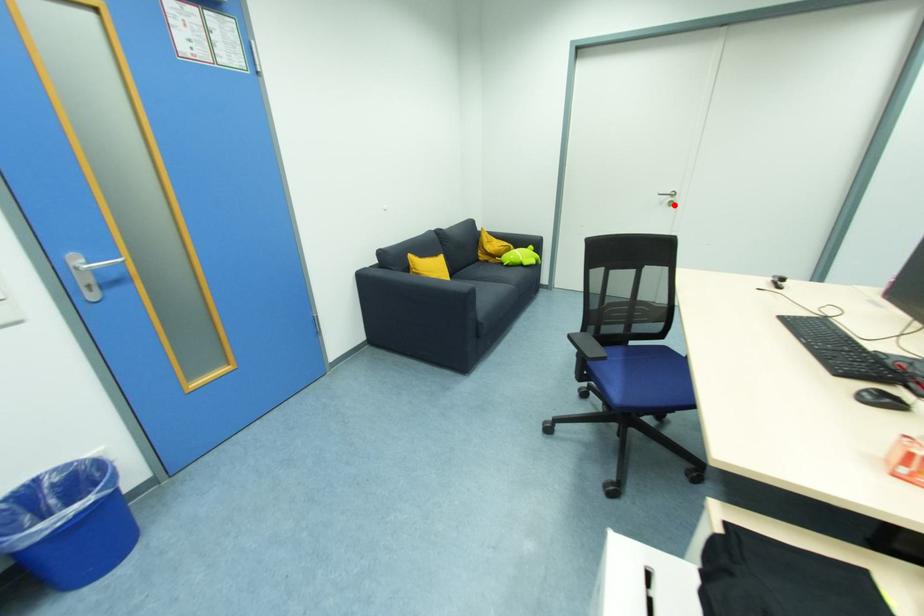
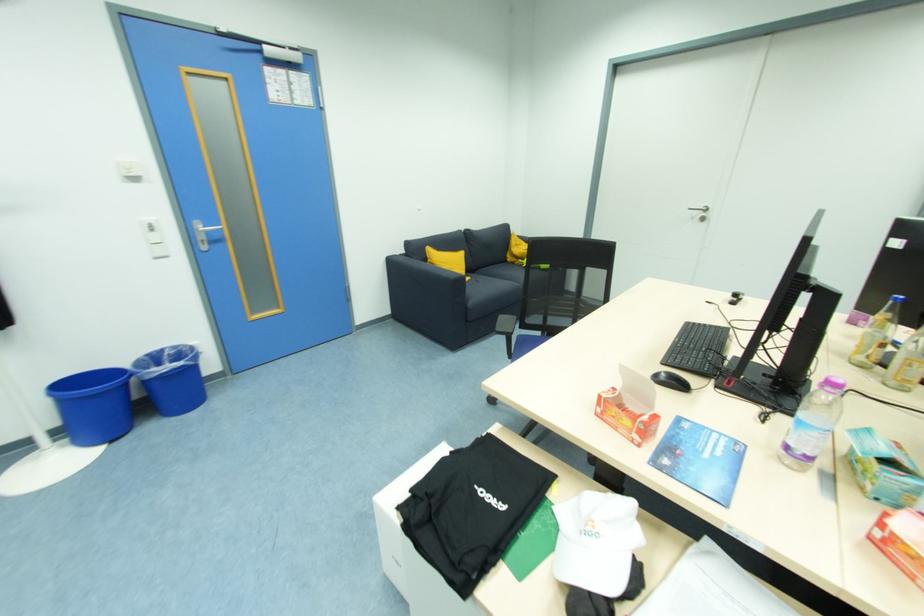
Question: I am providing you with two images of the same scene from different viewpoints. A red point is marked on the first image. At the location where the point appears in image 1, is it still visible in image 2?

Choices:
 (A) Yes
 (B) No

Answer: (A)